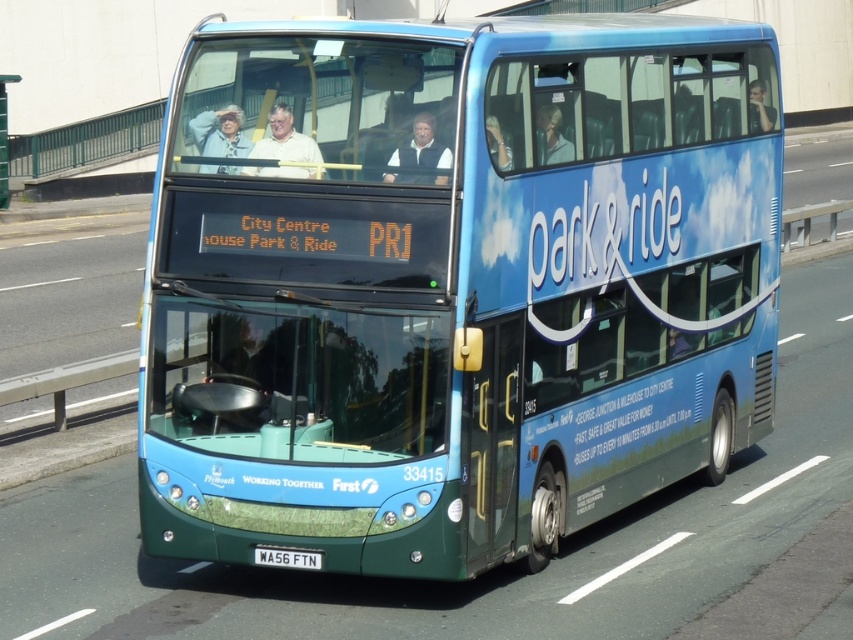
Is point (253, 211) more distant than point (276, 563)?

No, (253, 211) is in front of (276, 563).

Between blue metallic bus at center and black plastic license plate at lower center, which one is positioned higher?

blue metallic bus at center is higher up.

This screenshot has height=640, width=853. I want to click on blue metallic bus at center, so click(x=456, y=285).

From the picture: Which is above, matte white shirt at upper center or black plastic license plate at lower center?

matte white shirt at upper center

Is matte white shirt at upper center thinner than black plastic license plate at lower center?

No.

Between point (276, 109) and point (279, 552), which one is positioned in front?

Point (276, 109)

You are a GUI agent. You are given a task and a screenshot of the screen. Output one action in this format:
    pyautogui.click(x=<x>, y=<y>)
    Task: Click on the matte white shirt at upper center
    
    Given the screenshot: What is the action you would take?
    pyautogui.click(x=285, y=140)

Consider the image. Which of these two, blue metallic bus at center or matte white shirt at upper center, stands taller?

matte white shirt at upper center

Looking at this image, does blue metallic bus at center appear under matte white shirt at upper center?

Correct, blue metallic bus at center is located below matte white shirt at upper center.

Find the location of a particular element. blue metallic bus at center is located at coordinates pos(456,285).